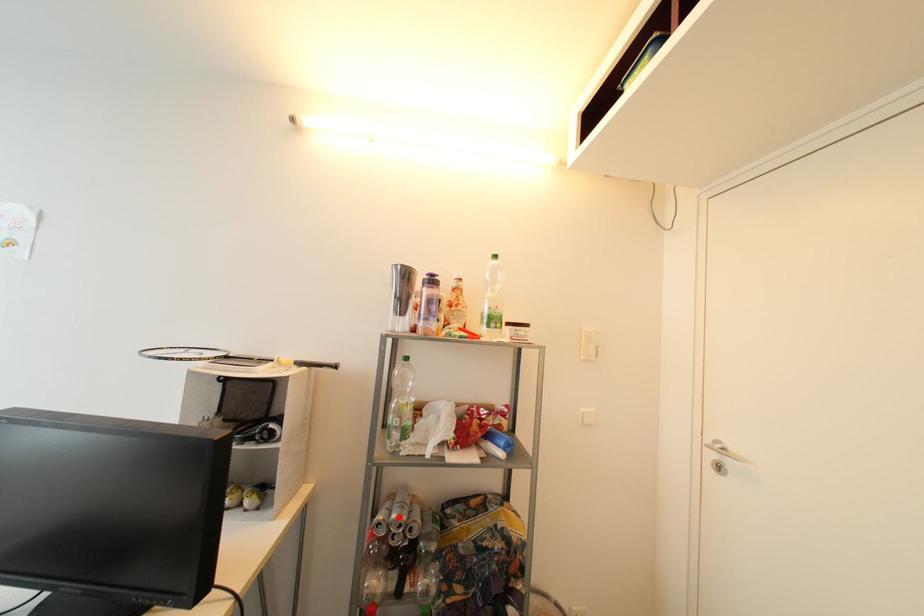
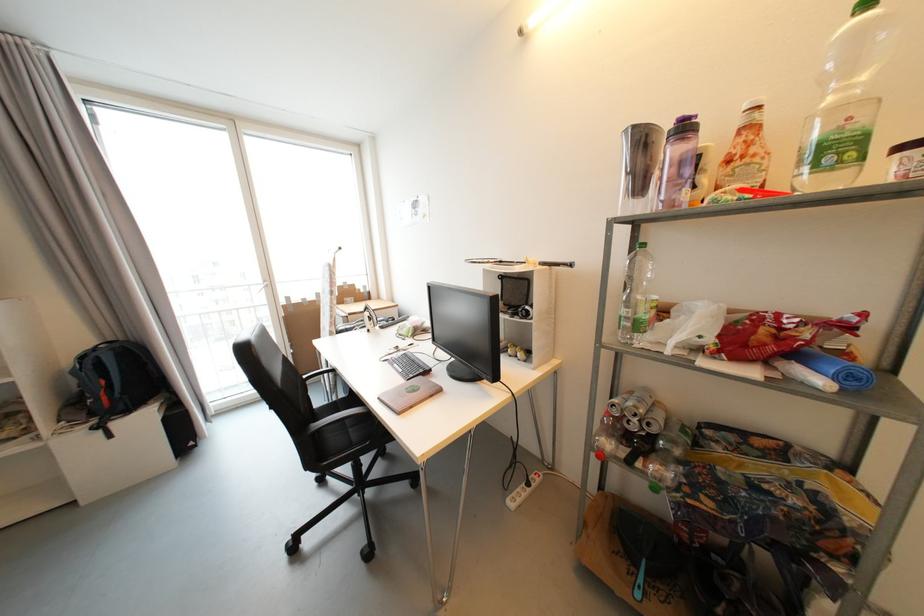
Locate, in the second image, the point that corresponds to the highlighted location in the first image.

(635, 406)